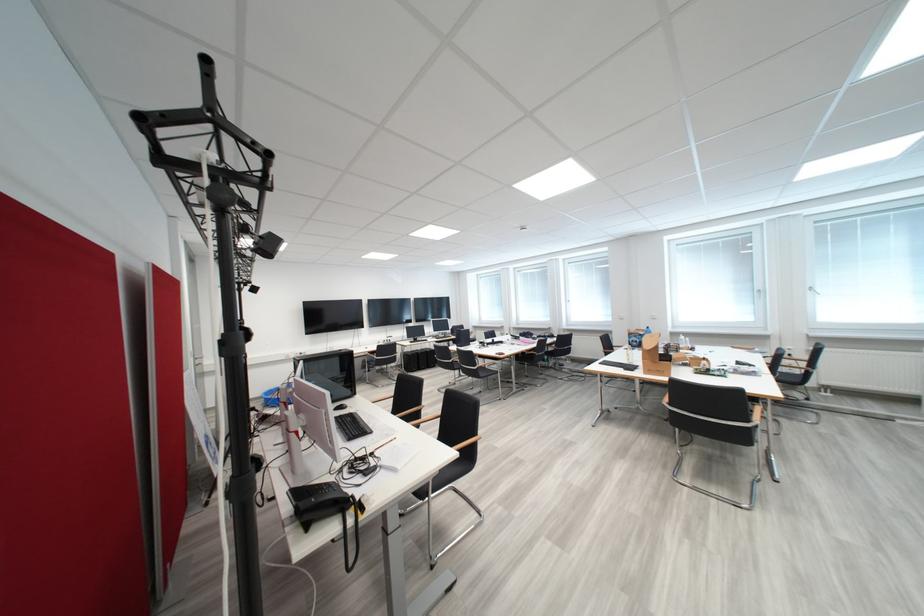
Where is `stand adjustment knob`? stand adjustment knob is located at coordinates (234, 342).